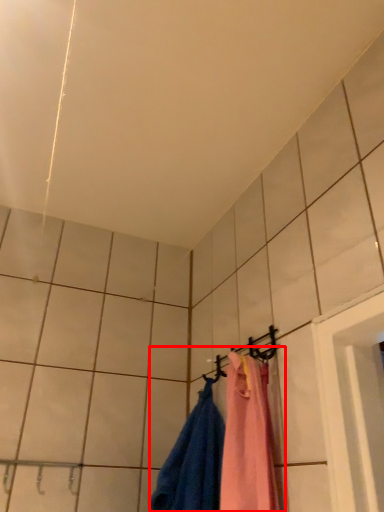
Question: From the image, what is the correct spatial relationship of laundry (annotated by the red box) in relation to hanger?

Choices:
 (A) right
 (B) left

Answer: (B)